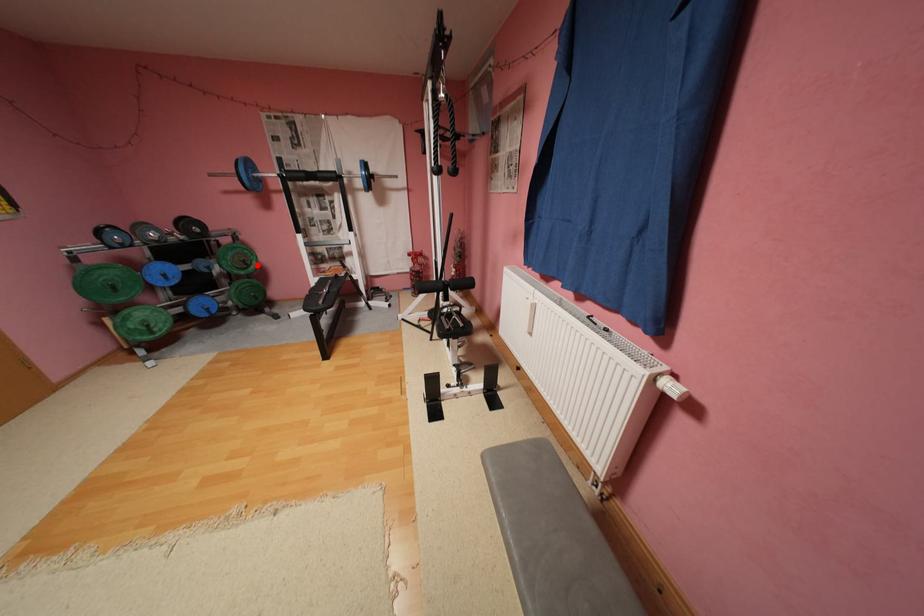
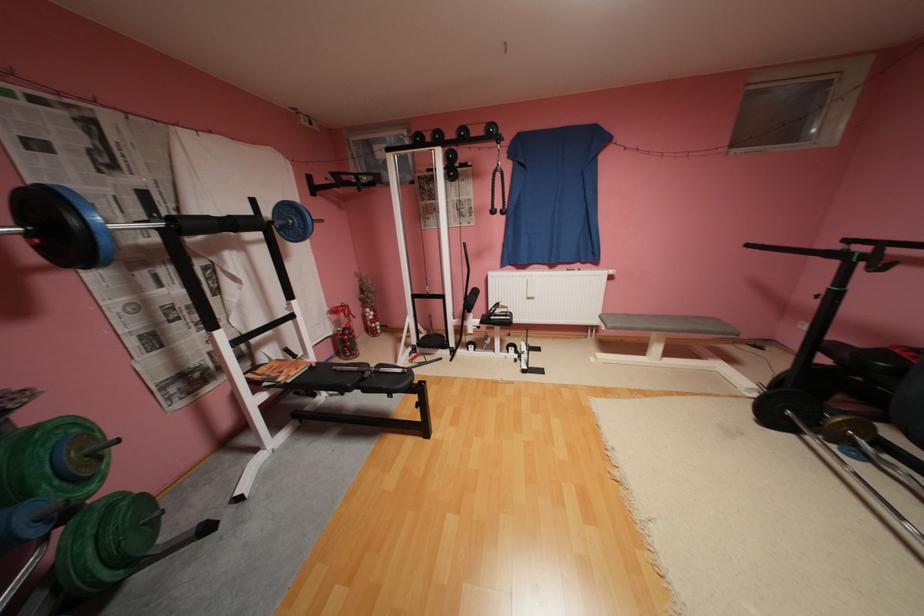
In the second image, find the point that corresponds to the highlighted location in the first image.

(111, 459)